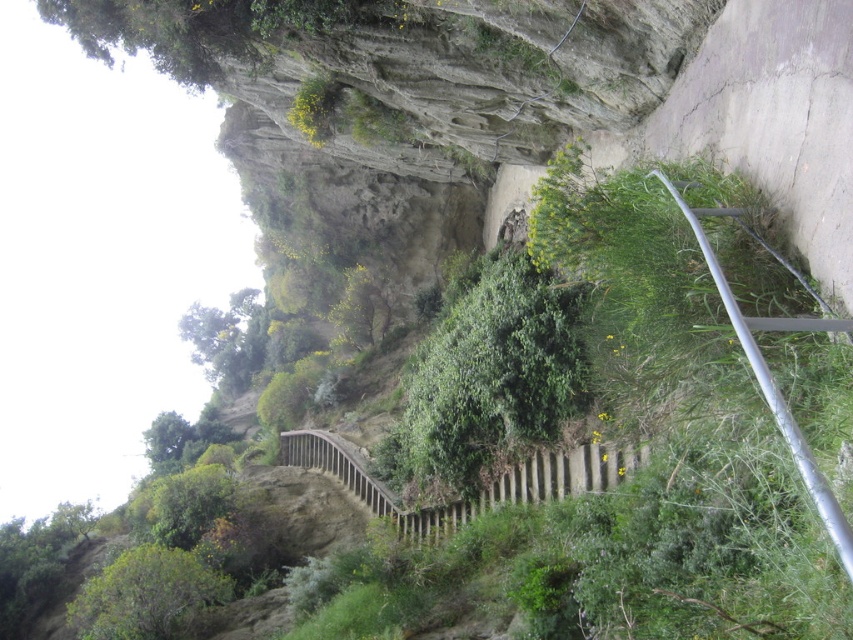
Question: Which point is farther from the camera taking this photo?

Choices:
 (A) (512, 465)
 (B) (784, 401)
 (C) (456, 374)

Answer: (C)

Question: Which object appears closest to the camera in this image?

Choices:
 (A) silver metallic rail at right
 (B) green leafy bush at center

Answer: (A)

Question: Is green leafy bush at center wider than silver metallic rail at right?

Choices:
 (A) yes
 (B) no

Answer: (A)

Question: Is the position of green leafy bush at center less distant than that of silver metallic rail at right?

Choices:
 (A) yes
 (B) no

Answer: (B)

Question: Which object appears closest to the camera in this image?

Choices:
 (A) green leafy bush at center
 (B) brown wooden rail at center
 (C) silver metallic rail at right

Answer: (C)

Question: Is green leafy bush at center thinner than brown wooden rail at center?

Choices:
 (A) no
 (B) yes

Answer: (B)